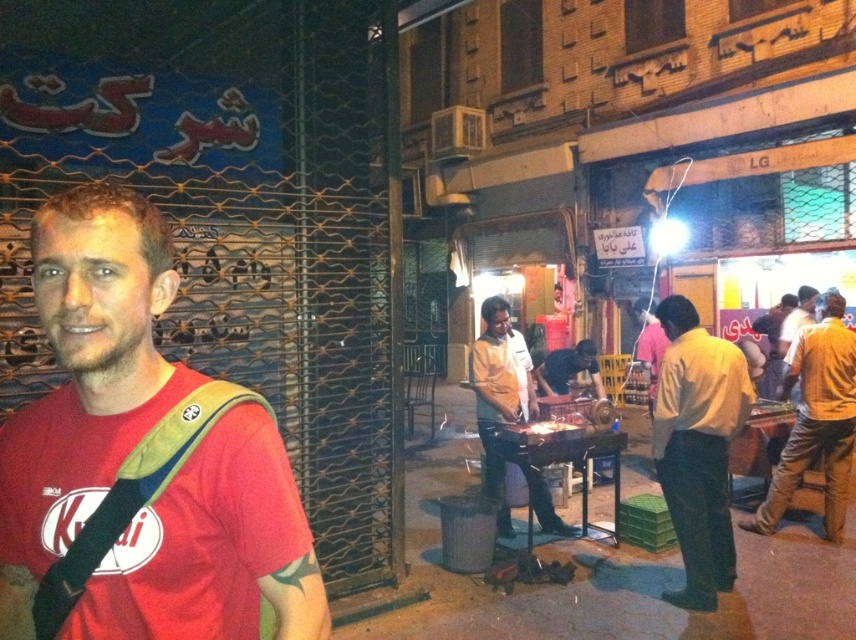
You are a photographer trying to capture both the red matte shirt at center and the light brown shirt at center in a single frame. Given their sizes, which shirt should you focus on to ensure both are visible without zooming in too much?

The red matte shirt at center has a lesser width compared to the light brown shirt at center, so you should focus on the light brown shirt at center as it is larger and will be more visible in the frame.

In the scene shown: You are a photographer standing at the edge of the street scene. You want to take a photo that includes both the yellow cotton shirt at right and the light brown shirt at center. Given that your camera has a maximum focus range of 1.5 meters, can you capture both shirts in focus without moving your position?

The yellow cotton shirt at right is 1.85 meters away from the light brown shirt at center, which exceeds the camera maximum focus range of 1.5 meters. Therefore, you cannot capture both shirts in focus without moving your position.

You are a street vendor who wants to wear a shirt that is wider than the one currently being worn by the man in the center. Which shirt should you choose between the yellow shirt at center and the yellow cotton shirt at right?

The yellow cotton shirt at right is wider than the yellow shirt at center, so you should choose the yellow cotton shirt at right.